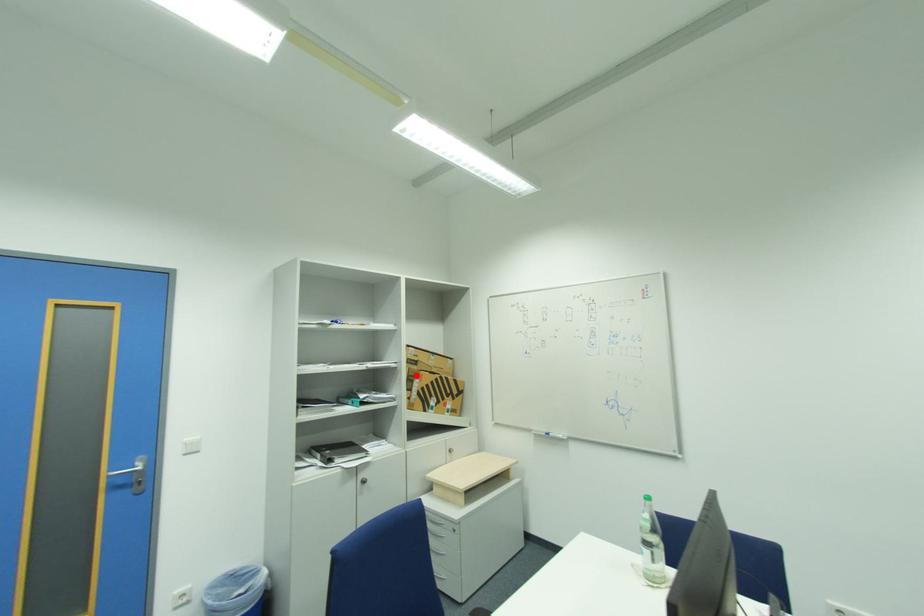
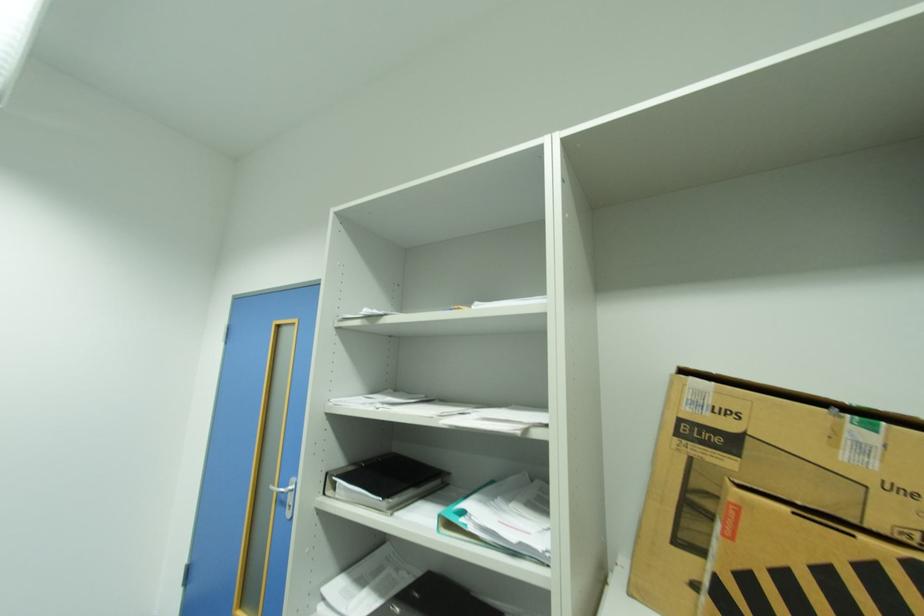
Find the pixel in the second image that matches the highlighted location in the first image.

(700, 487)